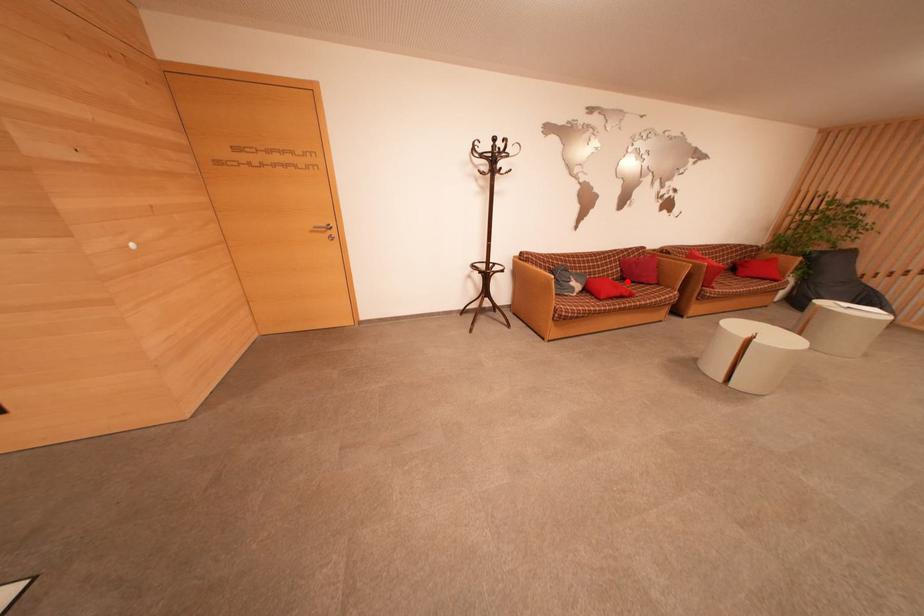
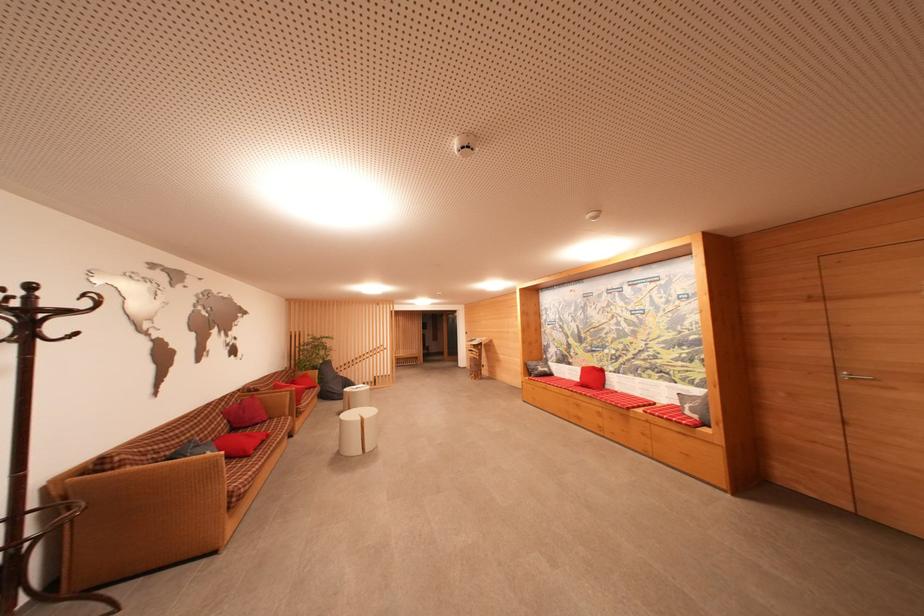
The point at the highlighted location is marked in the first image. Where is the corresponding point in the second image?

(237, 432)